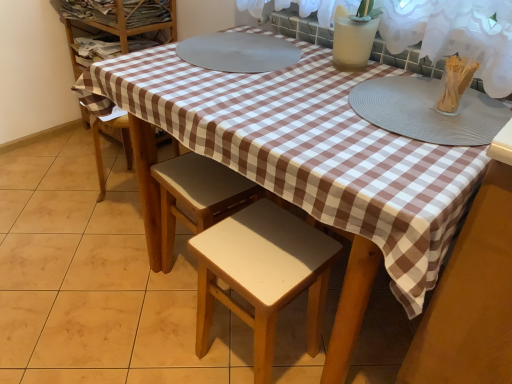
At what (x,y) coordinates should I click in order to perform the action: click on vacant space situated on the left part of light brown wood stool at center, marked as the 2th stool in a front-to-back arrangement. Please return your answer as a coordinate pair (x, y). This screenshot has height=384, width=512. Looking at the image, I should click on (138, 285).